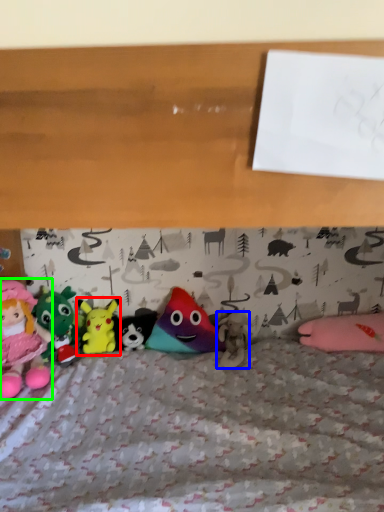
Question: Which object is the closest to the toy (highlighted by a red box)? Choose among these: toy (highlighted by a blue box) or toy (highlighted by a green box).

Choices:
 (A) toy
 (B) toy

Answer: (B)